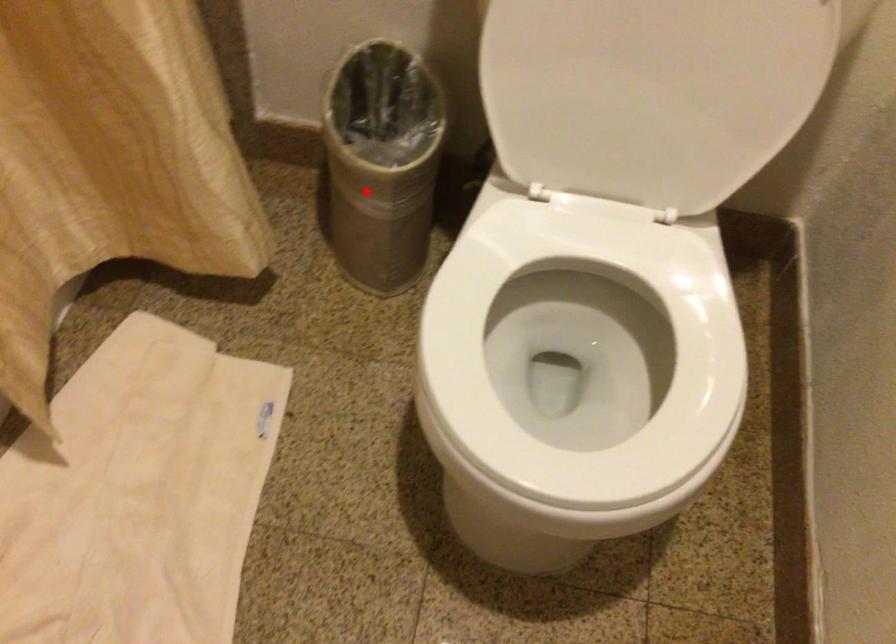
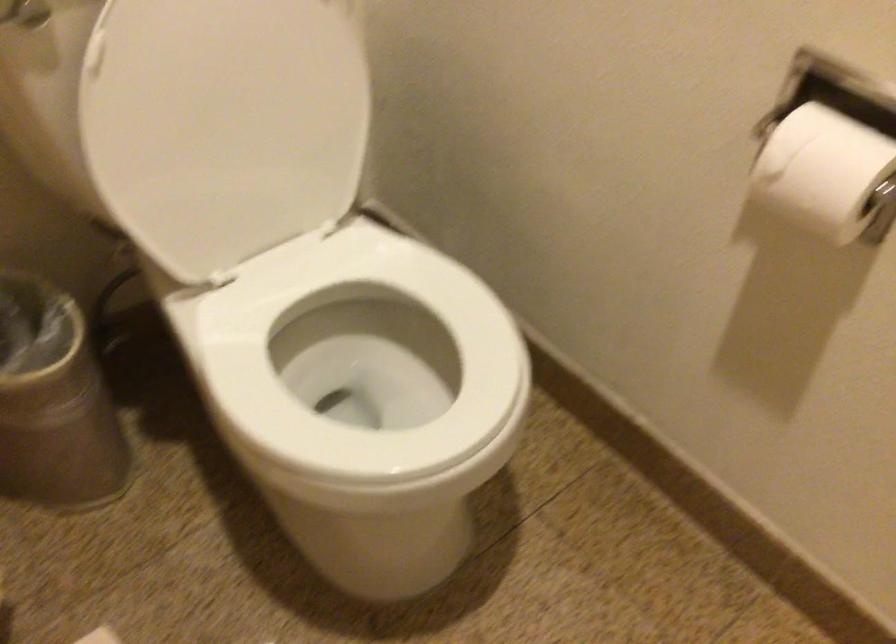
Where in the second image is the point corresponding to the highlighted location from the first image?

(54, 402)